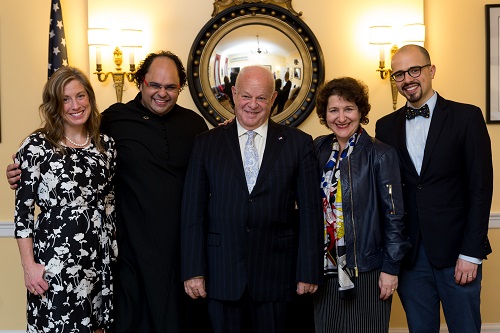
Where is `yellow wall`? The image size is (500, 333). yellow wall is located at coordinates (319, 19).